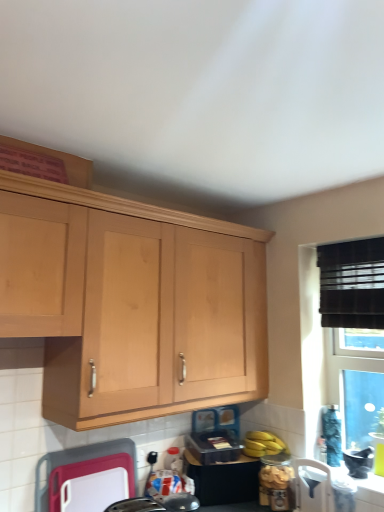
Question: From the image's perspective, is yellow matte bananas at lower right below white plastic chair at lower right, marked as the 1th appliance in a right-to-left arrangement?

Choices:
 (A) yes
 (B) no

Answer: (B)

Question: Is yellow matte bananas at lower right positioned far away from white plastic chair at lower right, marked as the 1th appliance in a right-to-left arrangement?

Choices:
 (A) no
 (B) yes

Answer: (A)

Question: From the image's perspective, is yellow matte bananas at lower right on top of white plastic chair at lower right, marked as the 1th appliance in a right-to-left arrangement?

Choices:
 (A) no
 (B) yes

Answer: (B)

Question: Considering the relative sizes of yellow matte bananas at lower right and white plastic chair at lower right, marked as the 1th appliance in a right-to-left arrangement, in the image provided, is yellow matte bananas at lower right bigger than white plastic chair at lower right, marked as the 1th appliance in a right-to-left arrangement,?

Choices:
 (A) no
 (B) yes

Answer: (B)

Question: Considering the relative sizes of yellow matte bananas at lower right and white plastic chair at lower right, the 3th appliance positioned from the left, in the image provided, is yellow matte bananas at lower right smaller than white plastic chair at lower right, the 3th appliance positioned from the left,?

Choices:
 (A) no
 (B) yes

Answer: (A)

Question: Based on their positions, is translucent glass jar at lower right, the 2th appliance in the left-to-right sequence, located to the left or right of white plastic cutting board at lower center, which is counted as the first appliance, starting from the left?

Choices:
 (A) right
 (B) left

Answer: (A)

Question: Considering their positions, is translucent glass jar at lower right, the 2th appliance in the left-to-right sequence, located in front of or behind white plastic cutting board at lower center, which is counted as the first appliance, starting from the left?

Choices:
 (A) behind
 (B) front

Answer: (A)

Question: From their relative heights in the image, would you say translucent glass jar at lower right, the 2th appliance in the right-to-left sequence, is taller or shorter than white plastic cutting board at lower center, arranged as the 3th appliance when viewed from the right?

Choices:
 (A) short
 (B) tall

Answer: (A)

Question: Based on their sizes in the image, would you say translucent glass jar at lower right, the 2th appliance in the left-to-right sequence, is bigger or smaller than white plastic cutting board at lower center, arranged as the 3th appliance when viewed from the right?

Choices:
 (A) big
 (B) small

Answer: (B)

Question: Is white plastic chair at lower right, the 3th appliance positioned from the left, inside the boundaries of white plastic cutting board at lower center, arranged as the 3th appliance when viewed from the right, or outside?

Choices:
 (A) outside
 (B) inside

Answer: (A)

Question: Considering the positions of point (319, 476) and point (43, 489), is point (319, 476) closer or farther from the camera than point (43, 489)?

Choices:
 (A) farther
 (B) closer

Answer: (A)

Question: From the image's perspective, is white plastic chair at lower right, the 3th appliance positioned from the left, above or below white plastic cutting board at lower center, which is counted as the first appliance, starting from the left?

Choices:
 (A) below
 (B) above

Answer: (A)

Question: Considering their positions, is white plastic chair at lower right, marked as the 1th appliance in a right-to-left arrangement, located in front of or behind white plastic cutting board at lower center, arranged as the 3th appliance when viewed from the right?

Choices:
 (A) behind
 (B) front

Answer: (A)

Question: In terms of size, does white plastic cutting board at lower center, arranged as the 3th appliance when viewed from the right, appear bigger or smaller than yellow matte bananas at lower right?

Choices:
 (A) small
 (B) big

Answer: (B)

Question: From a real-world perspective, is white plastic cutting board at lower center, which is counted as the first appliance, starting from the left, above or below yellow matte bananas at lower right?

Choices:
 (A) above
 (B) below

Answer: (B)